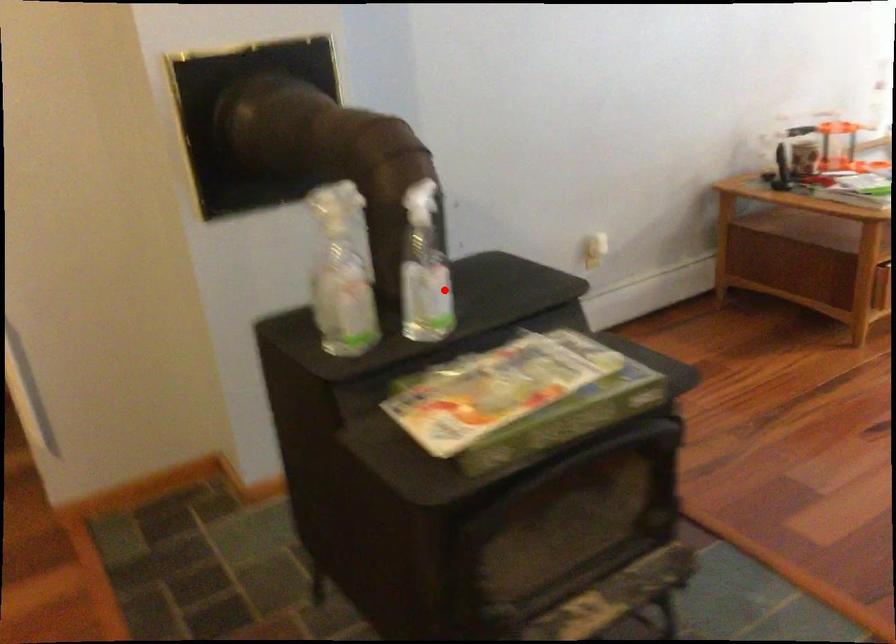
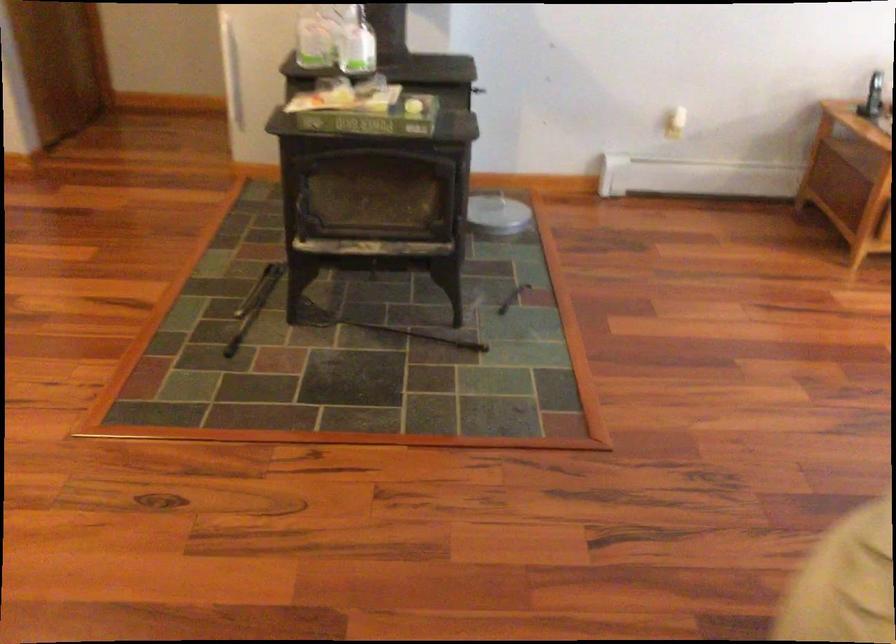
Question: I am providing you with two images of the same scene from different viewpoints. Image1 has a red point marked. In image2, the corresponding 3D location appears at what relative position? Reply with the corresponding letter.

Choices:
 (A) Closer
 (B) Farther

Answer: (B)